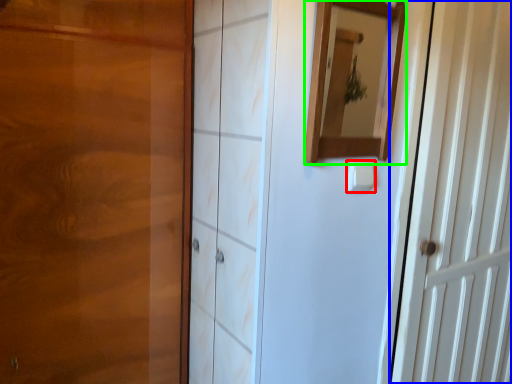
Question: Which object is the farthest from light switch (highlighted by a red box)? Choose among these: door (highlighted by a blue box) or mirror (highlighted by a green box).

Choices:
 (A) door
 (B) mirror

Answer: (A)